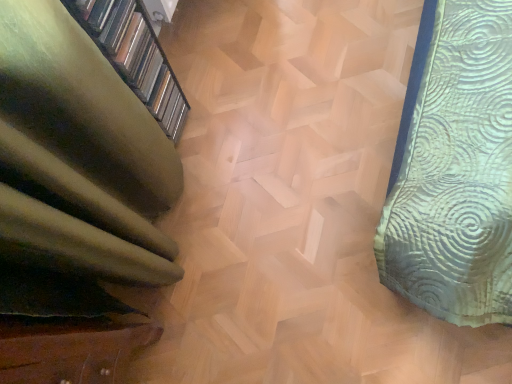
Question: Does wooden staircase at center have a greater width compared to green fabric at left?

Choices:
 (A) yes
 (B) no

Answer: (A)

Question: Can you confirm if wooden staircase at center is bigger than green fabric at left?

Choices:
 (A) no
 (B) yes

Answer: (B)

Question: Is wooden staircase at center directly adjacent to green fabric at left?

Choices:
 (A) yes
 (B) no

Answer: (B)

Question: Considering the relative sizes of wooden staircase at center and green fabric at left in the image provided, is wooden staircase at center shorter than green fabric at left?

Choices:
 (A) yes
 (B) no

Answer: (A)

Question: From a real-world perspective, is wooden staircase at center positioned over green fabric at left based on gravity?

Choices:
 (A) yes
 (B) no

Answer: (B)

Question: From the image's perspective, does wooden staircase at center appear lower than green fabric at left?

Choices:
 (A) yes
 (B) no

Answer: (A)

Question: Does green fabric at left have a greater width compared to wooden staircase at center?

Choices:
 (A) yes
 (B) no

Answer: (B)

Question: Is green fabric at left shorter than wooden staircase at center?

Choices:
 (A) yes
 (B) no

Answer: (B)

Question: Is green fabric at left thinner than wooden staircase at center?

Choices:
 (A) no
 (B) yes

Answer: (B)

Question: Is green fabric at left looking in the opposite direction of wooden staircase at center?

Choices:
 (A) no
 (B) yes

Answer: (A)

Question: Does green fabric at left touch wooden staircase at center?

Choices:
 (A) yes
 (B) no

Answer: (B)

Question: Would you say green fabric at left contains wooden staircase at center?

Choices:
 (A) yes
 (B) no

Answer: (B)

Question: From the image's perspective, is green fabric at left located above or below wooden staircase at center?

Choices:
 (A) above
 (B) below

Answer: (A)